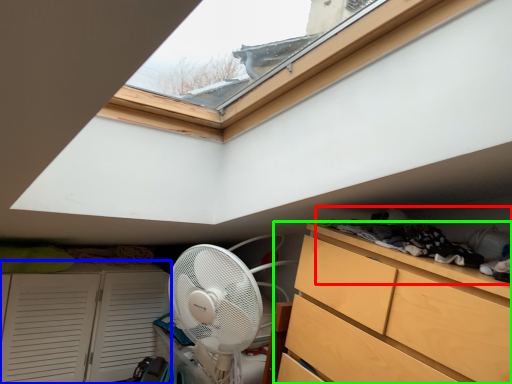
Question: Which object is the closest to the laundry (highlighted by a red box)? Choose among these: cupboard (highlighted by a blue box) or chest of drawers (highlighted by a green box).

Choices:
 (A) cupboard
 (B) chest of drawers

Answer: (B)